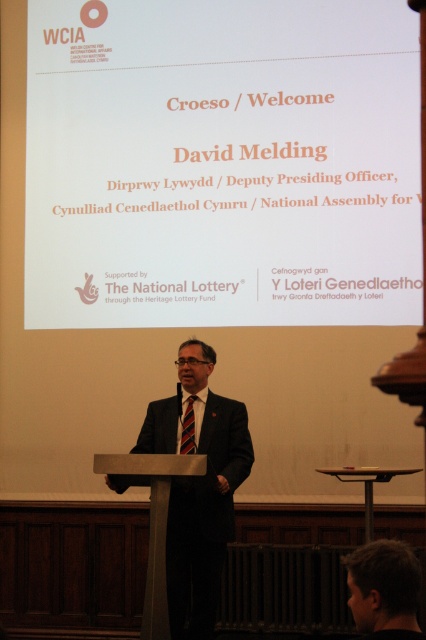
Between black suit at center and striped fabric tie at center, which one has more height?

With more height is black suit at center.

Can you confirm if black suit at center is positioned below striped fabric tie at center?

Result: Yes.

Locate an element on the screen. This screenshot has height=640, width=426. black suit at center is located at coordinates (198, 488).

You are a GUI agent. You are given a task and a screenshot of the screen. Output one action in this format:
    pyautogui.click(x=<x>, y=<y>)
    Task: Click on the black suit at center
    Image resolution: width=426 pixels, height=640 pixels.
    Given the screenshot: What is the action you would take?
    pyautogui.click(x=198, y=488)

Does white paper at upper center have a lesser height compared to striped fabric tie at center?

Incorrect, white paper at upper center's height does not fall short of striped fabric tie at center's.

Image resolution: width=426 pixels, height=640 pixels. Describe the element at coordinates (221, 163) in the screenshot. I see `white paper at upper center` at that location.

Measure the distance between white paper at upper center and camera.

A distance of 7.43 meters exists between white paper at upper center and camera.

Locate an element on the screen. white paper at upper center is located at coordinates (221, 163).

Is point (419, 588) closer to viewer compared to point (187, 442)?

That is True.

Can you confirm if dark brown hair at lower right is smaller than striped fabric tie at center?

Incorrect, dark brown hair at lower right is not smaller in size than striped fabric tie at center.

Who is more forward, (362,548) or (184,433)?

Point (362,548) is in front.

This screenshot has height=640, width=426. In order to click on dark brown hair at lower right in this screenshot , I will do `click(385, 589)`.